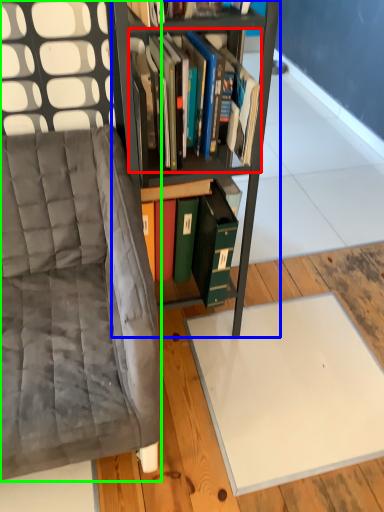
Question: Which object is positioned closest to book (highlighted by a red box)? Select from bookcase (highlighted by a blue box) and chair (highlighted by a green box).

Choices:
 (A) bookcase
 (B) chair

Answer: (A)